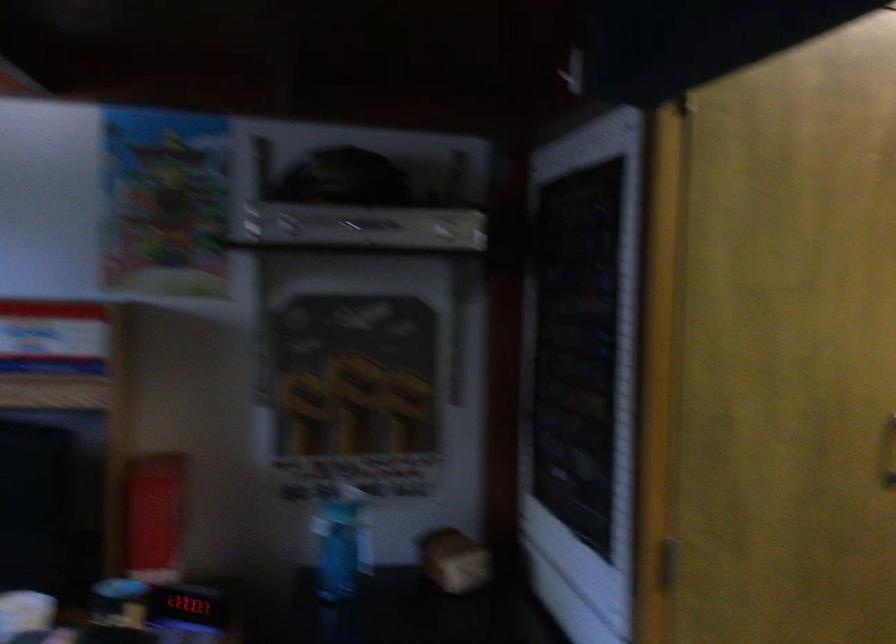
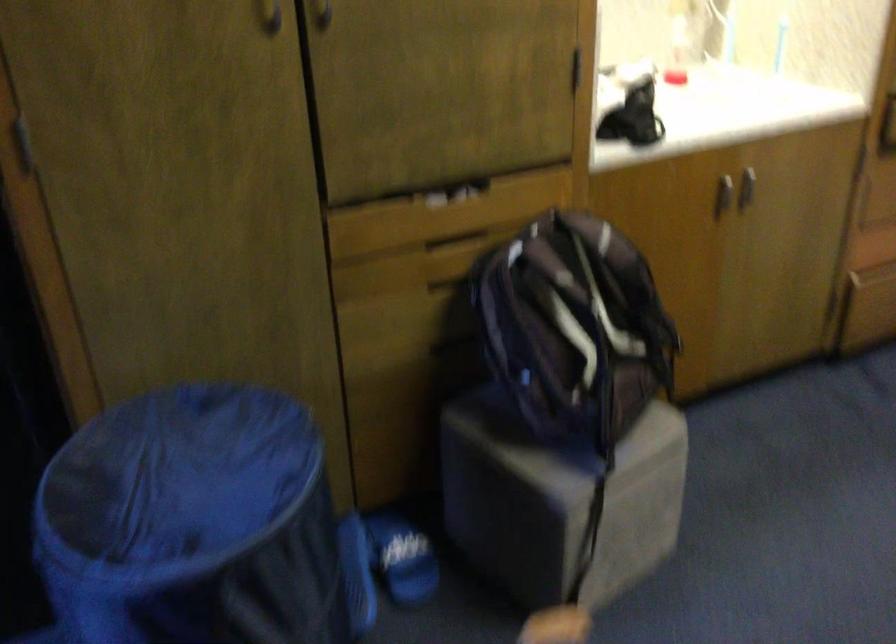
Question: How did the camera likely rotate?

Choices:
 (A) Left
 (B) Right
 (C) Up
 (D) Down

Answer: (D)